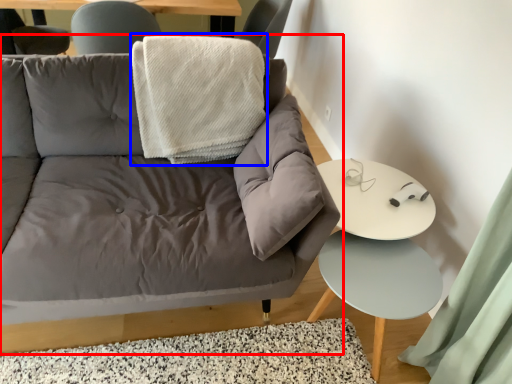
Question: Among these objects, which one is nearest to the camera, studio couch (highlighted by a red box) or blanket (highlighted by a blue box)?

Choices:
 (A) studio couch
 (B) blanket

Answer: (A)